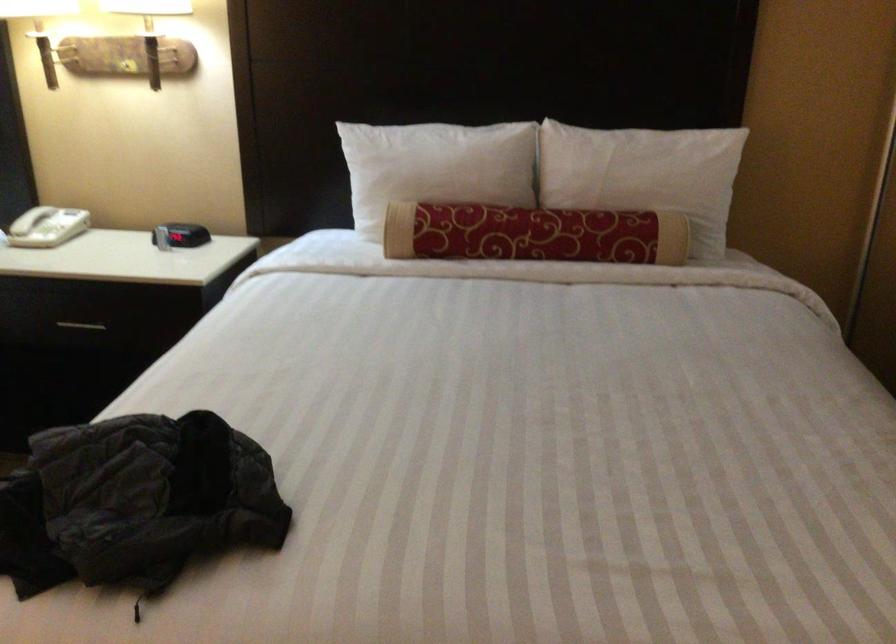
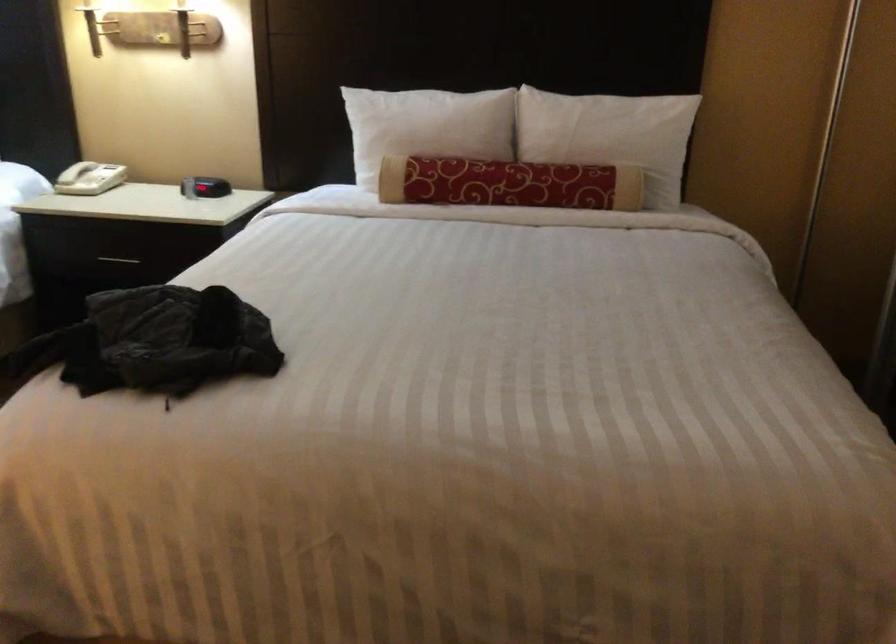
The images are taken continuously from a first-person perspective. In which direction are you moving?

The movement direction of the cameraman is right, backward.